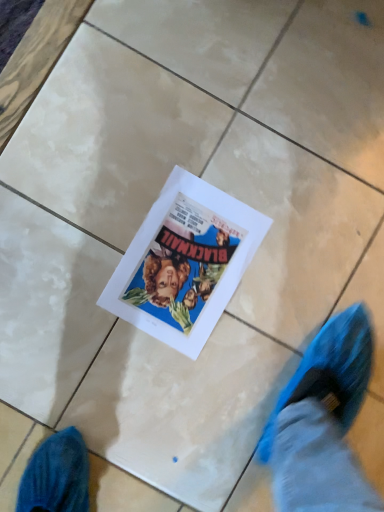
This screenshot has width=384, height=512. Find the location of `free location to the right of white paper at center`. free location to the right of white paper at center is located at coordinates (273, 323).